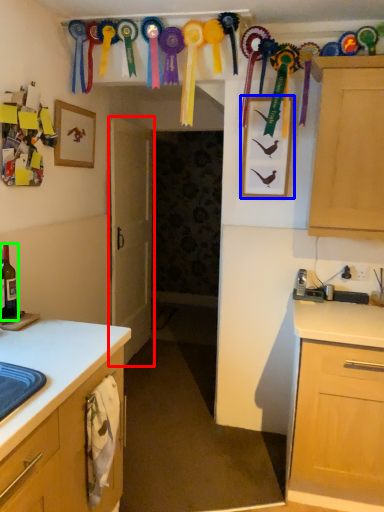
Question: Which object is positioned closest to door (highlighted by a red box)? Select from picture frame (highlighted by a blue box) and beer bottle (highlighted by a green box).

Choices:
 (A) picture frame
 (B) beer bottle

Answer: (A)